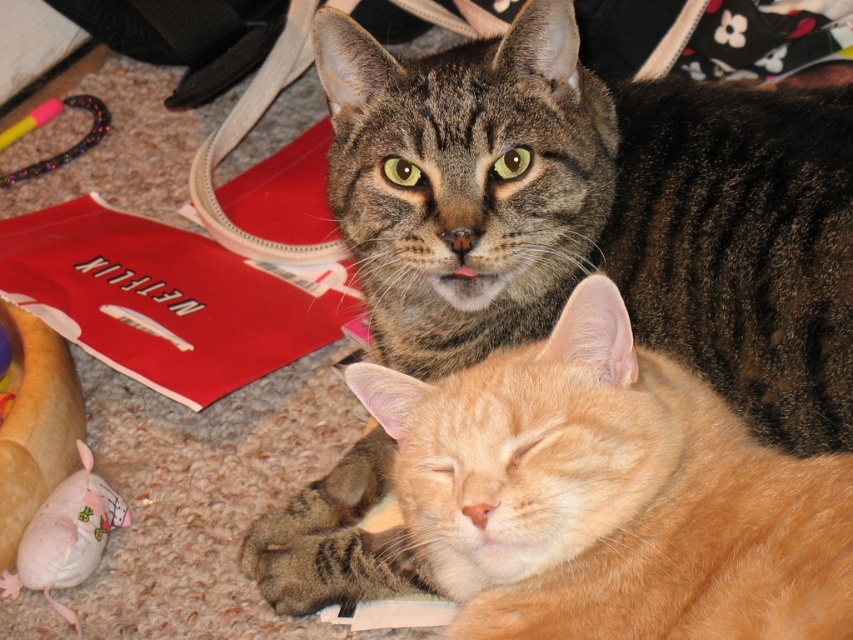
You are a cat owner who wants to place a new toy between the tabby fur cat at upper center and the pink fabric mouse at lower left. The toy requires 30 inches of space to be placed safely. Can you fit it there?

The distance between the tabby fur cat at upper center and the pink fabric mouse at lower left is 31.57 inches, which is more than enough space to place the toy requiring 30 inches of space safely.

You are standing at the origin of the coordinate system in the image. You see two points, point (726, 99) and point (59, 557). Which point is closer to you?

Point (59, 557) is closer to you because it is in front of point (726, 99).